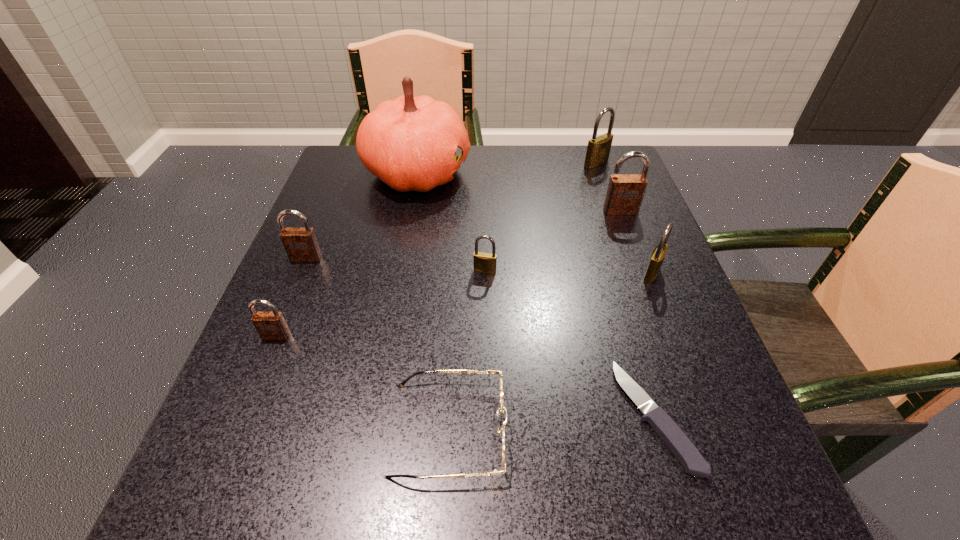
Locate an element on the screen. The height and width of the screenshot is (540, 960). steak knife at the right edge is located at coordinates (679, 444).

What are the coordinates of `object present at the far left corner` in the screenshot? It's located at (410, 143).

At what (x,y) coordinates should I click in order to perform the action: click on object that is positioned at the far right corner. Please return your answer as a coordinate pair (x, y). Looking at the image, I should click on (598, 150).

Image resolution: width=960 pixels, height=540 pixels. Find the location of `object at the near right corner`. object at the near right corner is located at coordinates (679, 444).

In the image, there is a desktop. Where is `free region at the far edge`? free region at the far edge is located at coordinates (509, 171).

In the image, there is a desktop. Where is `free space at the near edge`? free space at the near edge is located at coordinates (424, 493).

This screenshot has width=960, height=540. I want to click on free space at the left edge of the desktop, so pos(291,397).

At what (x,y) coordinates should I click in order to perform the action: click on free space at the right edge. Please return your answer as a coordinate pair (x, y). The image size is (960, 540). Looking at the image, I should click on (603, 218).

In the image, there is a desktop. Where is `vacant area at the far left corner`? This screenshot has height=540, width=960. vacant area at the far left corner is located at coordinates (328, 191).

At what (x,y) coordinates should I click in order to perform the action: click on free location at the near left corner. Please return your answer as a coordinate pair (x, y). Looking at the image, I should click on (305, 490).